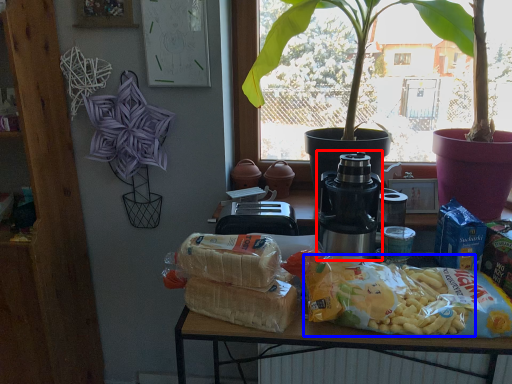
Question: Which object appears farthest to the camera in this image, yoghurt (highlighted by a red box) or food (highlighted by a blue box)?

Choices:
 (A) yoghurt
 (B) food

Answer: (A)